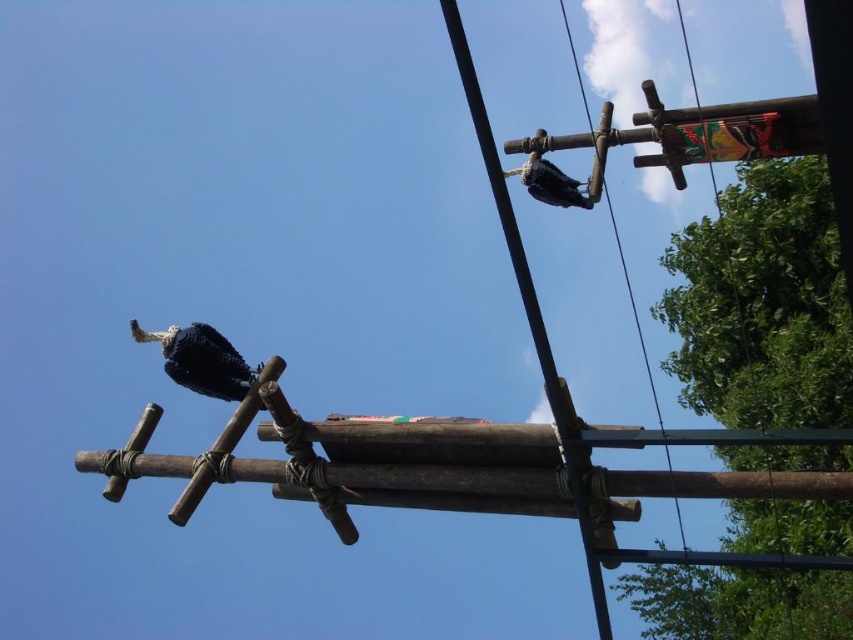
Which is in front, point (206, 326) or point (538, 200)?

Point (206, 326) is more forward.

Locate an element on the screen. The image size is (853, 640). blue speckled feathers at left is located at coordinates (201, 360).